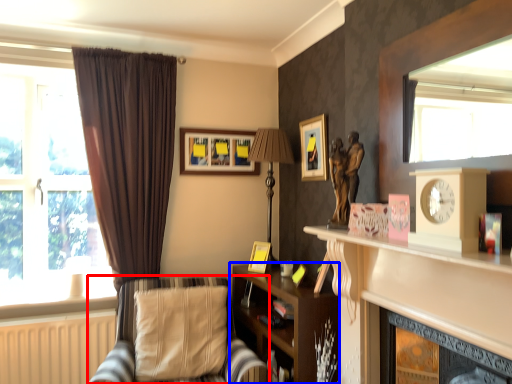
Question: Among these objects, which one is nearest to the camera, chair (highlighted by a red box) or shelf (highlighted by a blue box)?

Choices:
 (A) chair
 (B) shelf

Answer: (A)